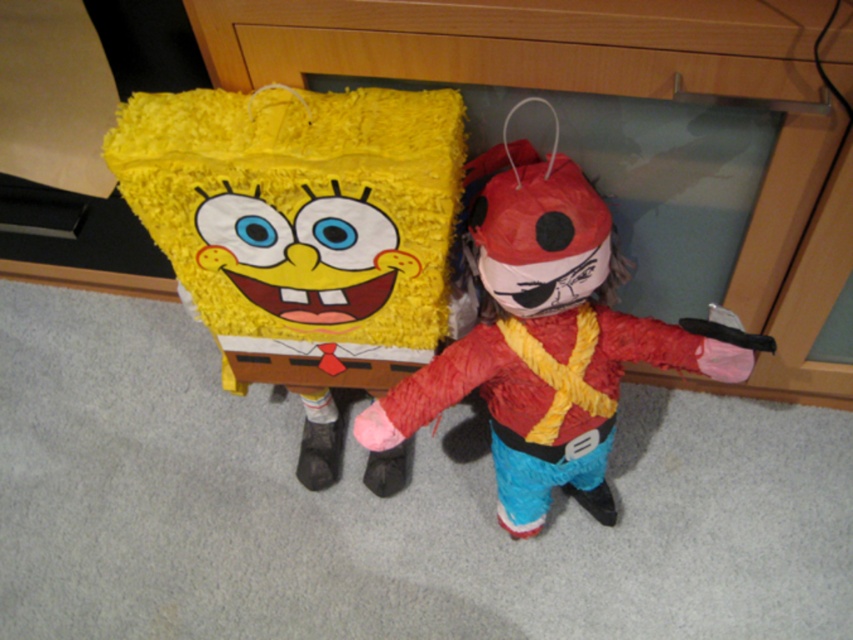
Question: In this image, where is matte yellow sponge at center located relative to wooden dresser at center?

Choices:
 (A) above
 (B) below

Answer: (B)

Question: Which object appears closest to the camera in this image?

Choices:
 (A) red felt pirate at center
 (B) matte yellow sponge at center

Answer: (A)

Question: Can you confirm if matte yellow sponge at center is wider than red felt pirate at center?

Choices:
 (A) no
 (B) yes

Answer: (A)

Question: Can you confirm if wooden dresser at center is bigger than red felt pirate at center?

Choices:
 (A) yes
 (B) no

Answer: (A)

Question: Which point is closer to the camera?

Choices:
 (A) (399, 204)
 (B) (793, 348)
 (C) (601, 384)

Answer: (A)

Question: Based on their relative distances, which object is nearer to the red felt pirate at center?

Choices:
 (A) matte yellow sponge at center
 (B) wooden dresser at center

Answer: (A)